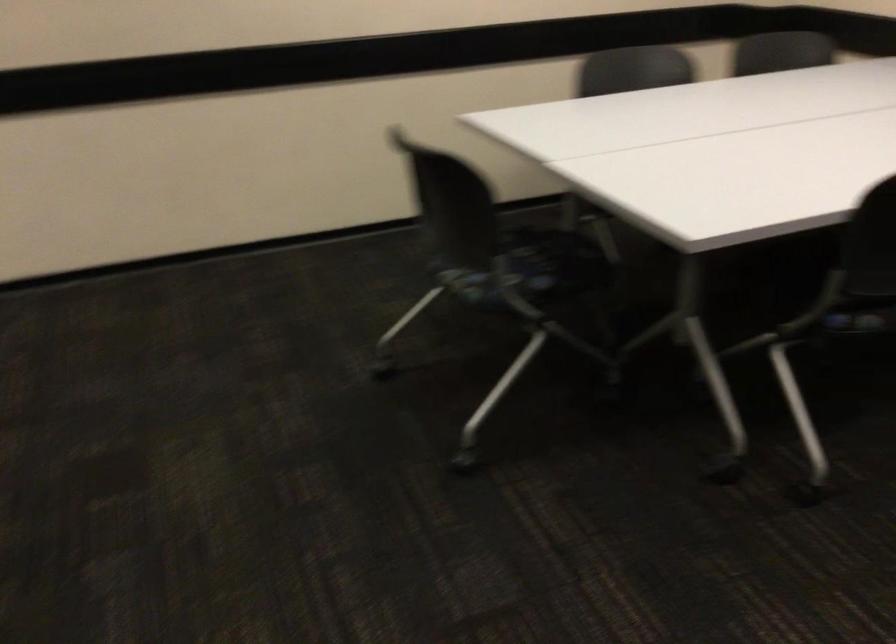
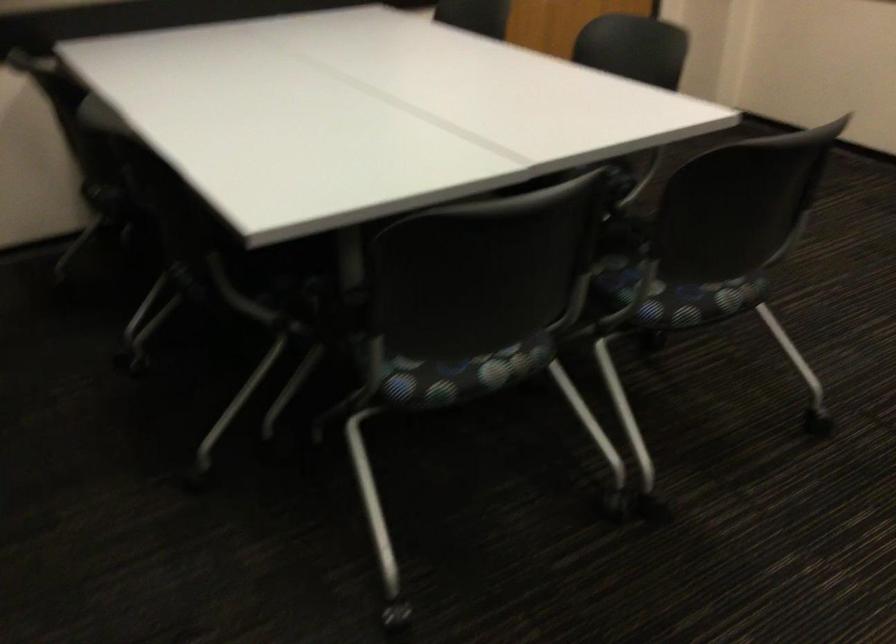
Based on the continuous images, in which direction is the camera rotating?

The rotation direction of the camera is left-down.